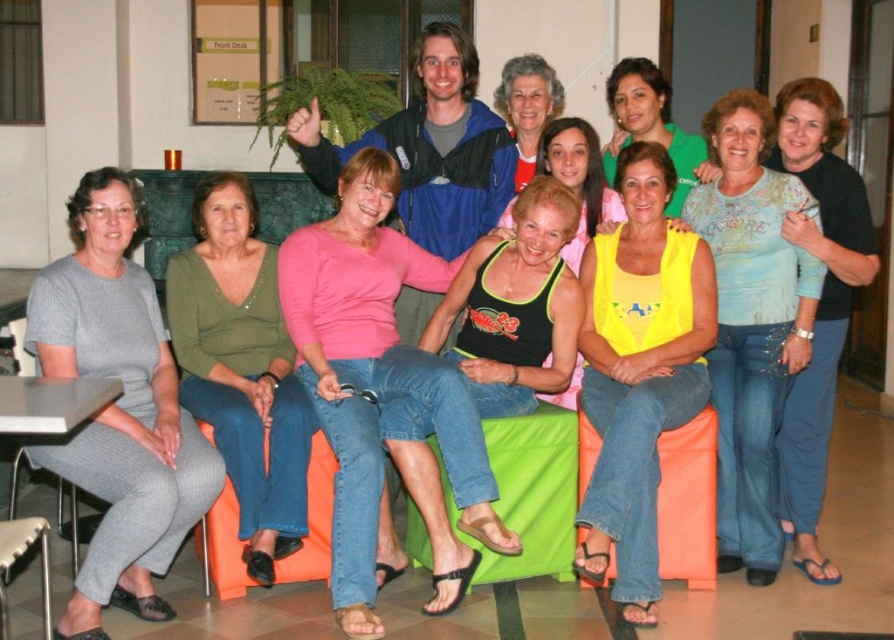
Question: Which of the following is the closest to the observer?

Choices:
 (A) (302, 320)
 (B) (504, 74)
 (C) (679, 392)

Answer: (C)

Question: Is matte green sweater at center to the right of matte yellow tank top at center from the viewer's perspective?

Choices:
 (A) yes
 (B) no

Answer: (B)

Question: Is matte yellow tank top at center positioned before matte black tank top at center?

Choices:
 (A) no
 (B) yes

Answer: (B)

Question: Is light blue cotton shirt at center smaller than black tank top at center?

Choices:
 (A) yes
 (B) no

Answer: (B)

Question: Which point is closer to the camera?

Choices:
 (A) 291,323
 (B) 110,420
 (C) 617,122

Answer: (B)

Question: Considering the real-world distances, which object is closest to the pink matte tank top at center?

Choices:
 (A) gray knit dress at left
 (B) matte black tank top at center

Answer: (A)